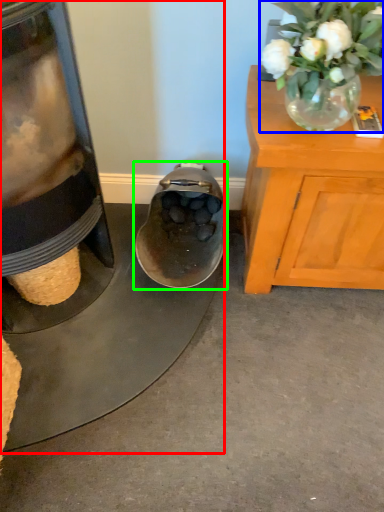
Question: Which object is the closest to the appliance (highlighted by a red box)? Choose among these: floral arrangement (highlighted by a blue box) or footwear (highlighted by a green box).

Choices:
 (A) floral arrangement
 (B) footwear

Answer: (B)